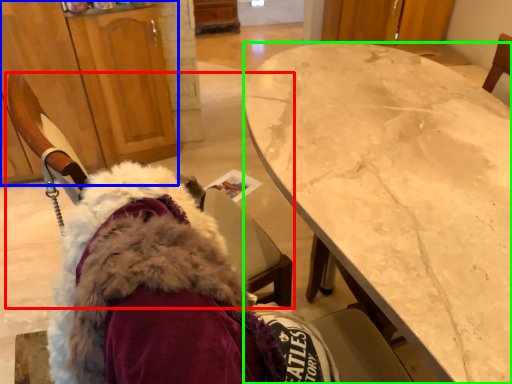
Question: Considering the real-world distances, which object is closest to chair (highlighted by a red box)? cabinetry (highlighted by a blue box) or desk (highlighted by a green box).

Choices:
 (A) cabinetry
 (B) desk

Answer: (B)